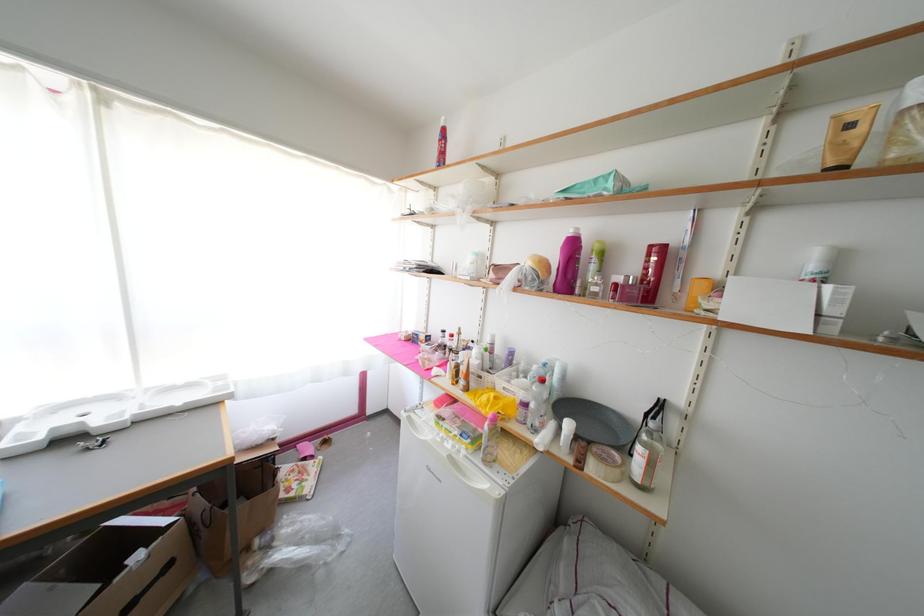
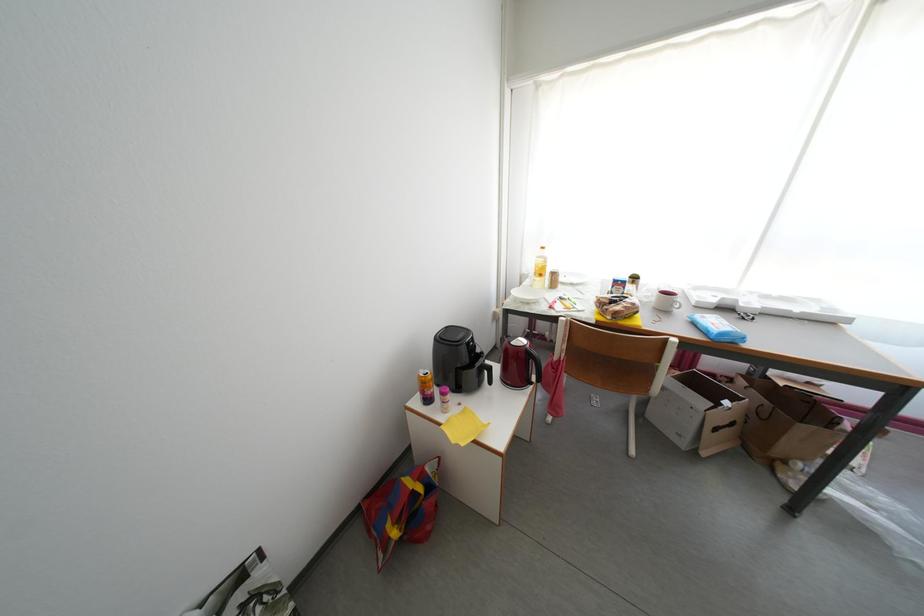
Looking at this image, the images are taken continuously from a first-person perspective. In which direction is your viewpoint rotating?

The rotation direction of the camera is left-down.